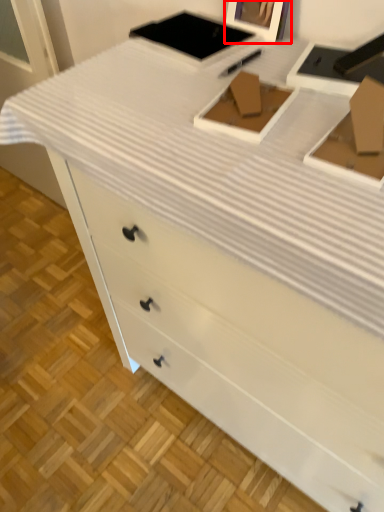
Question: From the image's perspective, what is the correct spatial positioning of picture frame (annotated by the red box) in reference to box?

Choices:
 (A) above
 (B) below

Answer: (A)